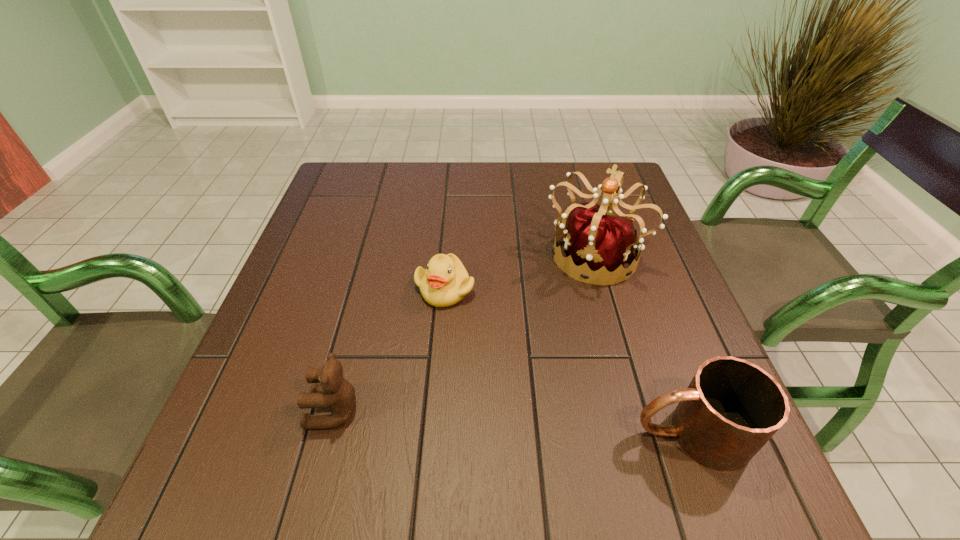
Locate an element on the screen. The height and width of the screenshot is (540, 960). free space on the desktop that is between the leftmost object and the mug and is positioned on the front-facing side of the tiara is located at coordinates (509, 421).

At what (x,y) coordinates should I click in order to perform the action: click on free space on the desktop that is between the teddy bear and the mug and is positioned on the front-facing side of the duckling. Please return your answer as a coordinate pair (x, y). This screenshot has height=540, width=960. Looking at the image, I should click on (456, 418).